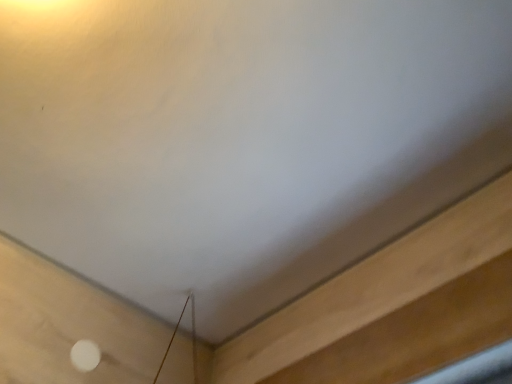
Question: From a real-world perspective, is light brown wood at lower right above or below white matte dot at lower left?

Choices:
 (A) above
 (B) below

Answer: (B)

Question: From the image's perspective, is light brown wood at lower right positioned above or below white matte dot at lower left?

Choices:
 (A) above
 (B) below

Answer: (A)

Question: Does point (285, 357) appear closer or farther from the camera than point (81, 362)?

Choices:
 (A) farther
 (B) closer

Answer: (A)

Question: In terms of height, does white matte dot at lower left look taller or shorter compared to light brown wood at lower right?

Choices:
 (A) tall
 (B) short

Answer: (B)

Question: In terms of width, does white matte dot at lower left look wider or thinner when compared to light brown wood at lower right?

Choices:
 (A) wide
 (B) thin

Answer: (B)

Question: From the image's perspective, relative to light brown wood at lower right, is white matte dot at lower left above or below?

Choices:
 (A) below
 (B) above

Answer: (A)

Question: From a real-world perspective, is white matte dot at lower left physically located above or below light brown wood at lower right?

Choices:
 (A) above
 (B) below

Answer: (A)